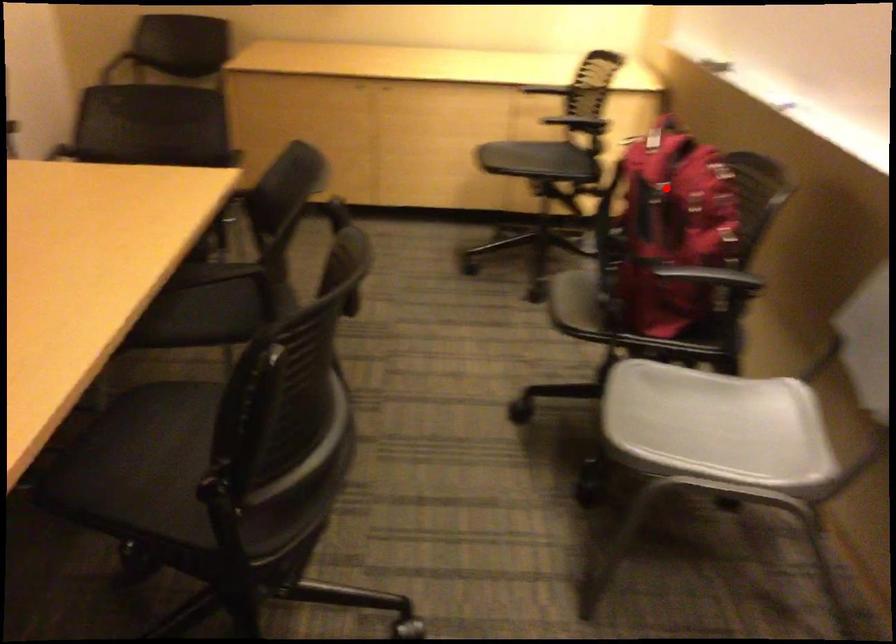
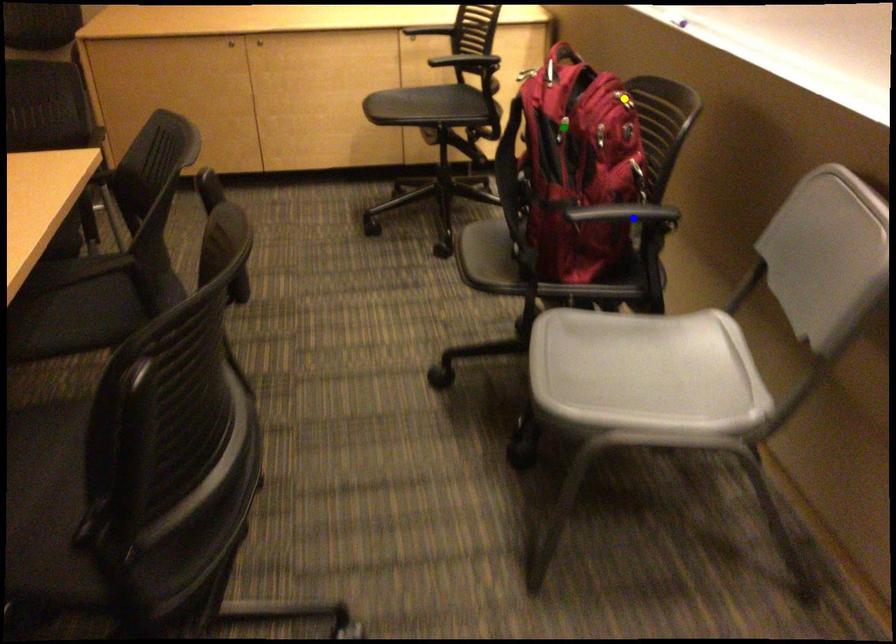
Question: I am providing you with two images of the same scene from different viewpoints. A red point is marked on the first image. You are given multiple points on the second image. Which mark in image 2 goes with the point in image 1?

Choices:
 (A) green point
 (B) yellow point
 (C) blue point

Answer: (A)